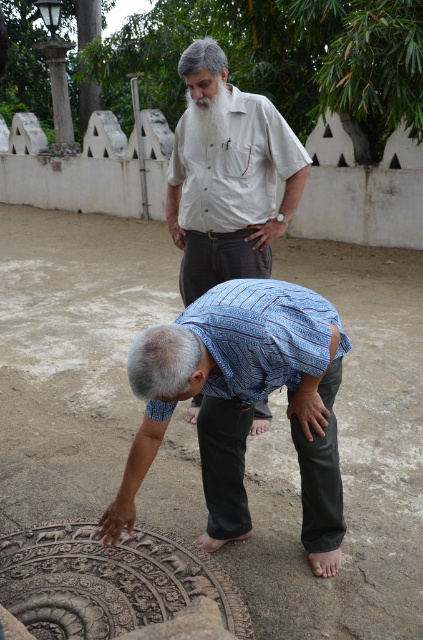
Between carved stone manhole cover at lower left and light beige cotton shirt at center, which one has less height?

With less height is light beige cotton shirt at center.

Is carved stone manhole cover at lower left above light beige cotton shirt at center?

Incorrect, carved stone manhole cover at lower left is not positioned above light beige cotton shirt at center.

Locate an element on the screen. The width and height of the screenshot is (423, 640). carved stone manhole cover at lower left is located at coordinates (346, 461).

Between blue printed shirt at lower center and white cotton shirt at center, which one appears on the left side from the viewer's perspective?

blue printed shirt at lower center is more to the left.

Based on the photo, measure the distance between blue printed shirt at lower center and camera.

The distance of blue printed shirt at lower center from camera is 2.15 meters.

Locate an element on the screen. blue printed shirt at lower center is located at coordinates (244, 403).

Between white cotton shirt at center and white fluffy beard at upper center, which one is positioned higher?

Positioned higher is white fluffy beard at upper center.

Can you confirm if white cotton shirt at center is positioned below white fluffy beard at upper center?

Correct, white cotton shirt at center is located below white fluffy beard at upper center.

What do you see at coordinates (233, 163) in the screenshot?
I see `white cotton shirt at center` at bounding box center [233, 163].

The image size is (423, 640). Identify the location of white cotton shirt at center. (233, 163).